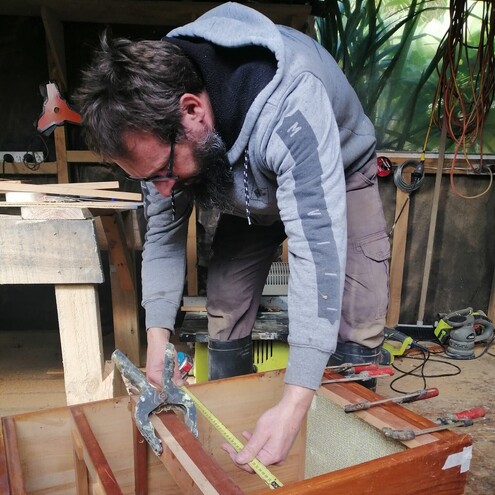
The width and height of the screenshot is (495, 495). What are the coordinates of `surge protector` in the screenshot? It's located at 17,154.